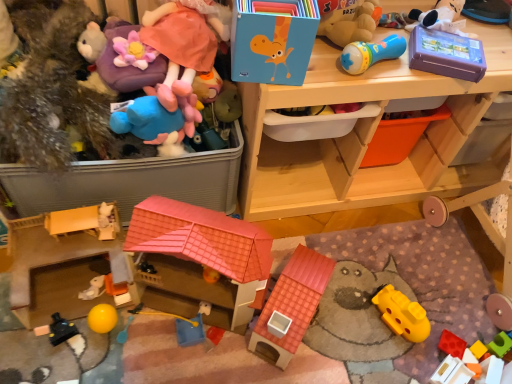
Image resolution: width=512 pixels, height=384 pixels. Identify the location of spots to the right of rubberized red block at lower right, the thirteenth toy viewed from the left. (483, 342).